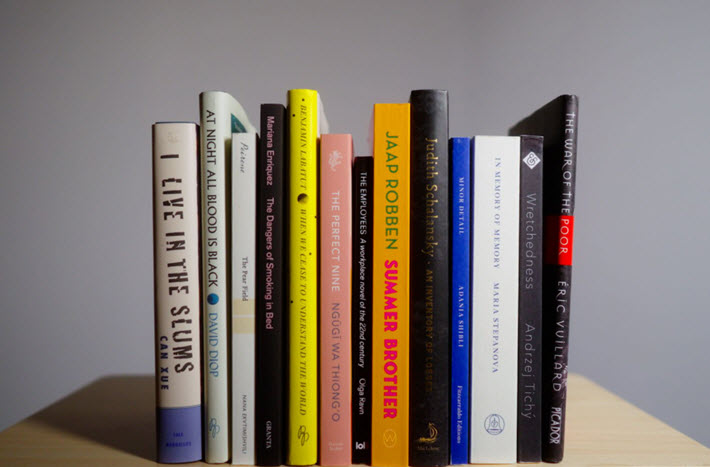
At what (x,y) coordinates should I click in order to perform the action: click on paperback books. Please return your answer as a coordinate pair (x, y). Looking at the image, I should click on (250, 183), (267, 170), (297, 154), (338, 164), (359, 181), (392, 178), (463, 173), (486, 173), (528, 175).